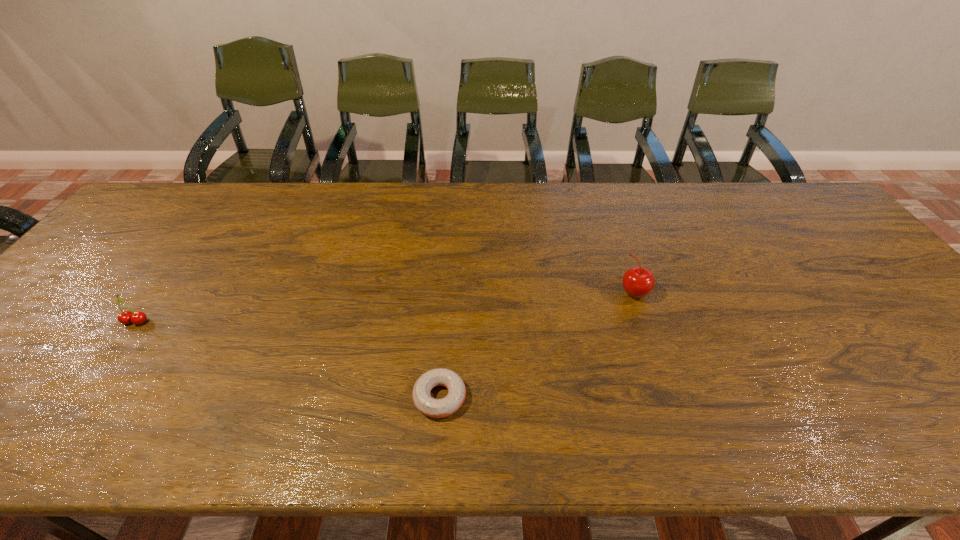
Where is `vacant area that lies between the left cherry and the shortest object`? This screenshot has width=960, height=540. vacant area that lies between the left cherry and the shortest object is located at coordinates (288, 359).

The width and height of the screenshot is (960, 540). Find the location of `empty location between the second object from left to right and the farthest object`. empty location between the second object from left to right and the farthest object is located at coordinates (537, 345).

The image size is (960, 540). What are the coordinates of `vacant space that's between the rightmost object and the leftmost object` in the screenshot? It's located at (385, 307).

Where is `object that is the second closest one to the nearer cherry`? object that is the second closest one to the nearer cherry is located at coordinates (638, 282).

Find the location of `object that stands as the second closest to the second nearest object`. object that stands as the second closest to the second nearest object is located at coordinates (638, 282).

Find the location of a particular element. vacant region that satisfies the following two spatial constraints: 1. with the stems of the nearer cherry pointing upwards; 2. on the left side of the shortest object is located at coordinates (81, 397).

This screenshot has height=540, width=960. Find the location of `free space that satisfies the following two spatial constraints: 1. on the back side of the right cherry; 2. on the right side of the second object from left to right`. free space that satisfies the following two spatial constraints: 1. on the back side of the right cherry; 2. on the right side of the second object from left to right is located at coordinates (447, 292).

I want to click on free point that satisfies the following two spatial constraints: 1. on the back side of the farther cherry; 2. on the left side of the shortest object, so click(447, 292).

At what (x,y) coordinates should I click in order to perform the action: click on vacant position in the image that satisfies the following two spatial constraints: 1. with the stems of the second nearest object pointing upwards; 2. on the left side of the second object from left to right. Please return your answer as a coordinate pair (x, y). The image size is (960, 540). Looking at the image, I should click on (81, 397).

Image resolution: width=960 pixels, height=540 pixels. Identify the location of vacant position in the image that satisfies the following two spatial constraints: 1. with the stems of the shortest object pointing upwards; 2. on the left side of the shorter cherry. (81, 397).